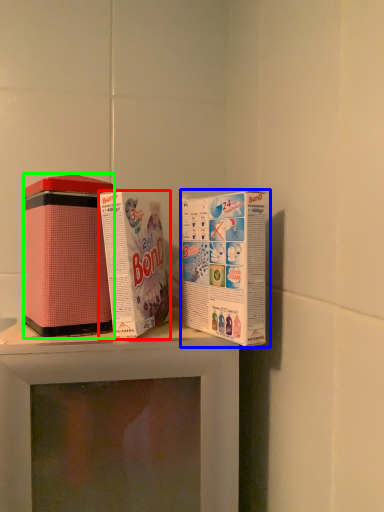
Question: Considering the real-world distances, which object is farthest from product (highlighted by a red box)? product (highlighted by a blue box) or product (highlighted by a green box)?

Choices:
 (A) product
 (B) product

Answer: (B)